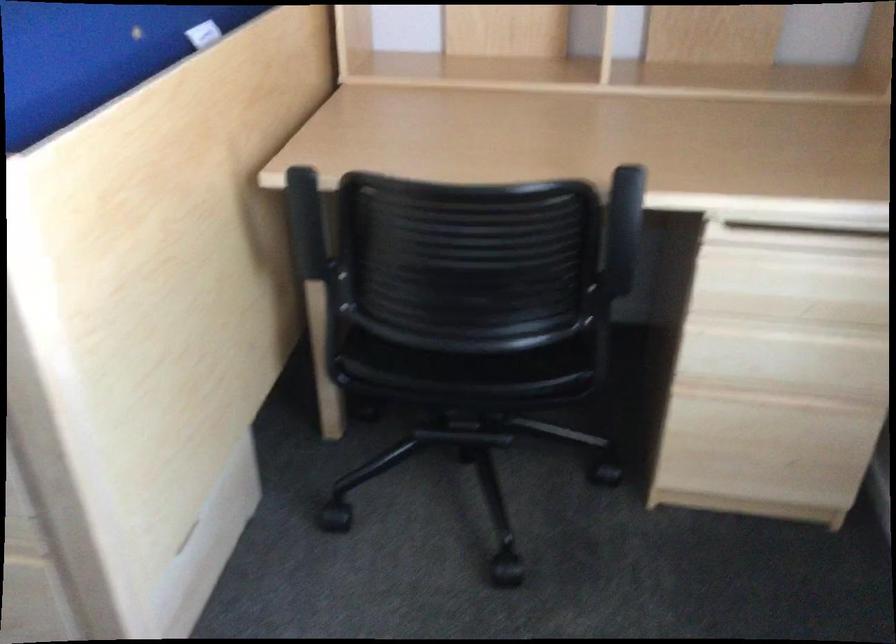
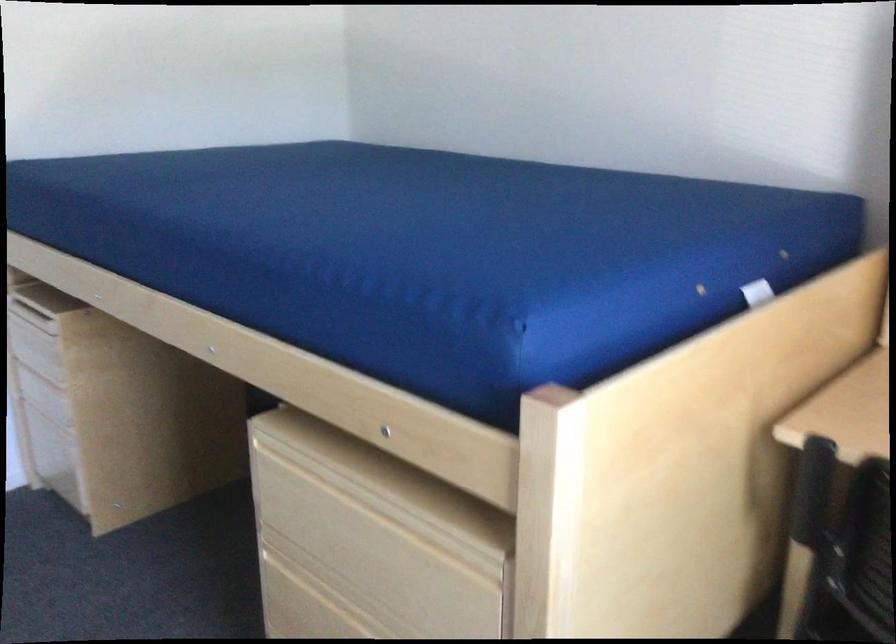
Question: How did the camera likely rotate?

Choices:
 (A) Left
 (B) Right
 (C) Up
 (D) Down

Answer: (A)